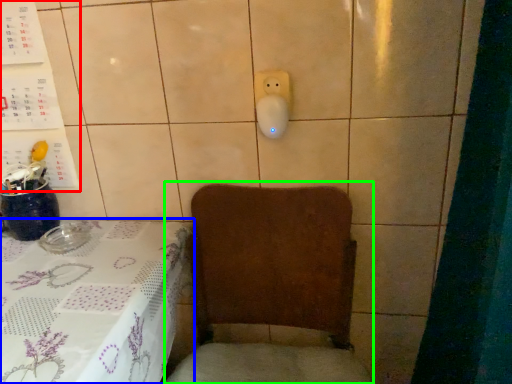
Question: Which object is positioned farthest from bulletin board (highlighted by a red box)? Select from furniture (highlighted by a blue box) and armchair (highlighted by a green box).

Choices:
 (A) furniture
 (B) armchair

Answer: (B)